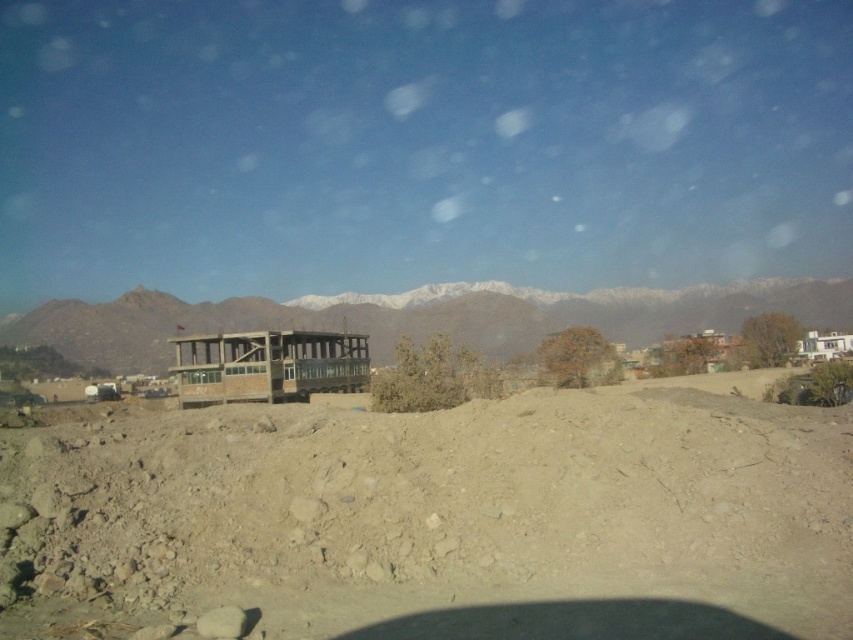
You are planning to build a hiking trail that goes from the snowy rocky mountain at center to the brown wooden gazebo at center. Since both are at the center, how will you decide the direction of the trail?

The snowy rocky mountain at center is above the brown wooden gazebo at center, so the trail should be built downward from the snowy rocky mountain at center to the brown wooden gazebo at center.

You are a drone operator trying to capture aerial footage of the construction site. You have two points of interest marked on your map at coordinates point (844, 404) and point (334, 358). Which point should you prioritize photographing first if you want to ensure clear visibility without adjusting the drone altitude?

Point (844, 404) should be prioritized because it is closer to the camera, ensuring clearer visibility without needing to adjust the drone altitude.

You are a construction worker planning to drive a heavy truck across the brown sandy dirt field at center and the snowy rocky mountain at center. Which path would be more stable for the truck to drive on based on their widths?

The brown sandy dirt field at center has a smaller width than the snowy rocky mountain at center, so the snowy rocky mountain at center would provide a more stable path for the truck since it is wider and can better support the vehicle.